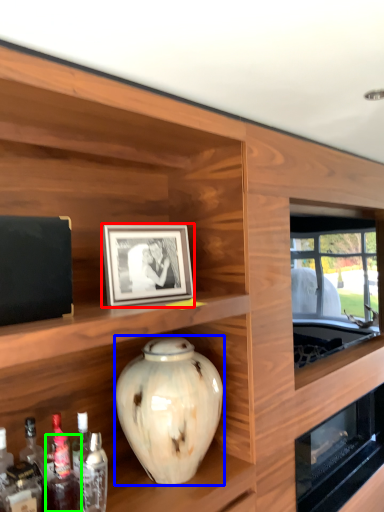
Question: Which object is the closest to the picture frame (highlighted by a red box)? Choose among these: vase (highlighted by a blue box) or bottle (highlighted by a green box).

Choices:
 (A) vase
 (B) bottle

Answer: (A)